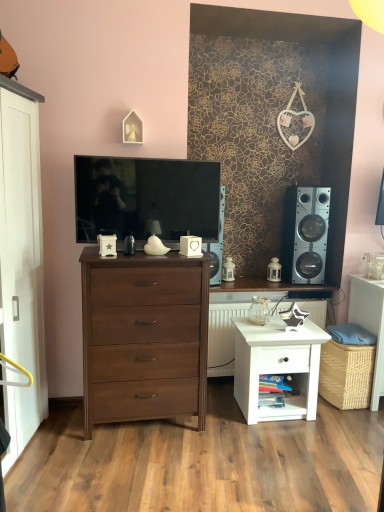
Question: In the image, is matte black tv at center positioned in front of or behind white glossy nightstand at lower right?

Choices:
 (A) front
 (B) behind

Answer: (A)

Question: Does point (77, 170) appear closer or farther from the camera than point (236, 388)?

Choices:
 (A) closer
 (B) farther

Answer: (A)

Question: Which is farther from the white glossy radiator at center?

Choices:
 (A) white glossy nightstand at lower right
 (B) dark wood chest of drawers at center
 (C) wooden angel at upper center
 (D) matte black tv at center
 (E) silver metallic speaker at right

Answer: (C)

Question: Estimate the real-world distances between objects in this image. Which object is closer to the matte black tv at center?

Choices:
 (A) woven wicker basket at lower right
 (B) wooden angel at upper center
 (C) dark wood chest of drawers at center
 (D) white glossy nightstand at lower right
 (E) silver metallic speaker at right

Answer: (B)